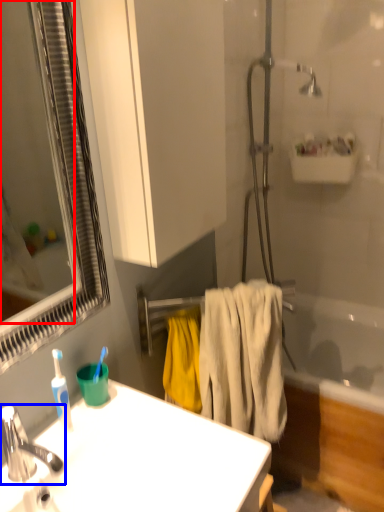
Question: Among these objects, which one is farthest to the camera, mirror (highlighted by a red box) or tap (highlighted by a blue box)?

Choices:
 (A) mirror
 (B) tap

Answer: (B)